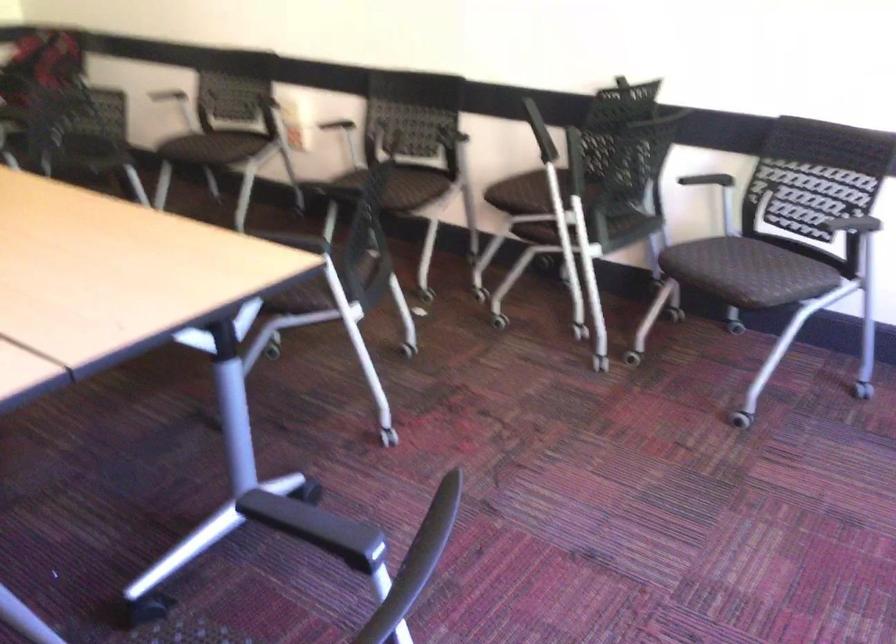
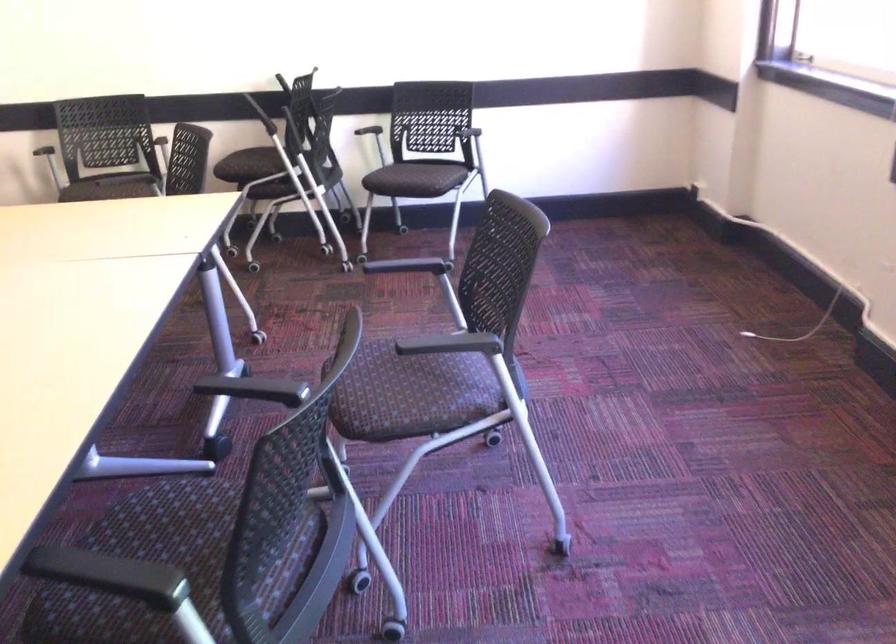
Locate, in the second image, the point that corresponds to pixel 529 202 in the first image.

(252, 166)